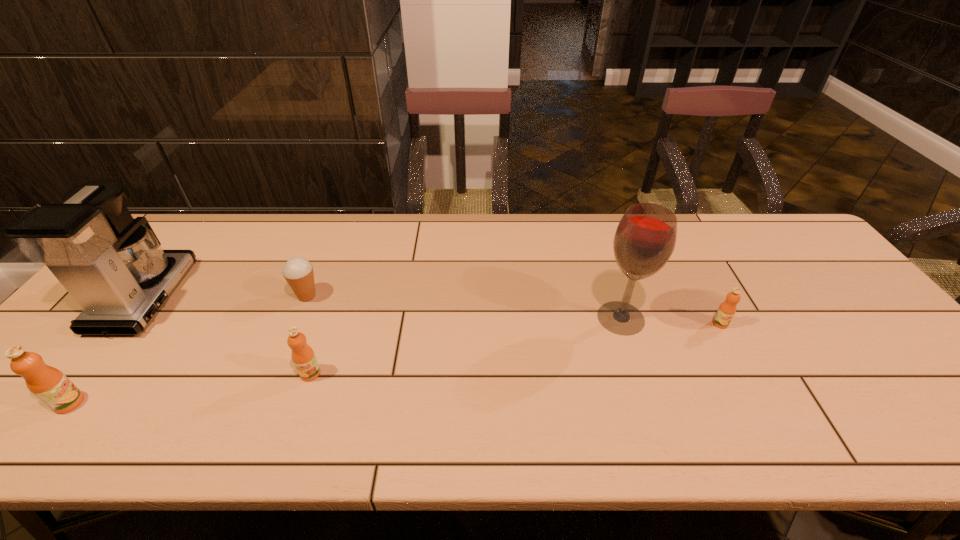
Find the location of a particular element. free space located on the front label of the rightmost orange juice is located at coordinates (762, 401).

The image size is (960, 540). In order to click on vacant space located on the right of the icecream in this screenshot , I will do click(433, 296).

Image resolution: width=960 pixels, height=540 pixels. Identify the location of vacant space situated 0.310m at the front of the coffee maker where the controls are located. (290, 297).

The height and width of the screenshot is (540, 960). What are the coordinates of `free space located on the back of the alcohol` in the screenshot? It's located at (605, 269).

The image size is (960, 540). Find the location of `orange juice that is positioned at the left edge`. orange juice that is positioned at the left edge is located at coordinates (48, 384).

I want to click on coffee maker present at the left edge, so click(x=113, y=265).

You are a GUI agent. You are given a task and a screenshot of the screen. Output one action in this format:
    pyautogui.click(x=<x>, y=<y>)
    Task: Click on the object present at the near left corner
    This screenshot has height=540, width=960.
    Given the screenshot: What is the action you would take?
    pyautogui.click(x=48, y=384)

This screenshot has height=540, width=960. Find the location of `vacant area at the far edge`. vacant area at the far edge is located at coordinates (245, 246).

Find the location of a particular element. vacant area at the near edge of the desktop is located at coordinates (x=629, y=388).

Identify the location of free region at the right edge. The width and height of the screenshot is (960, 540). (876, 374).